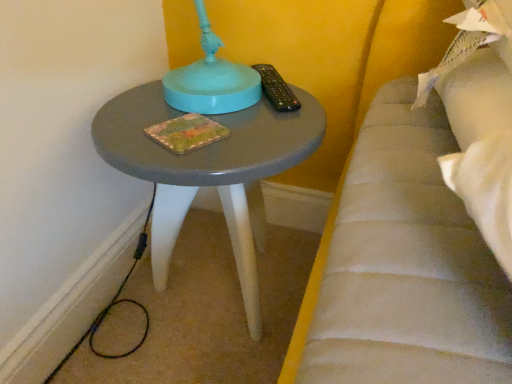
Identify the location of free space in front of black plastic remote at upper right. (258, 125).